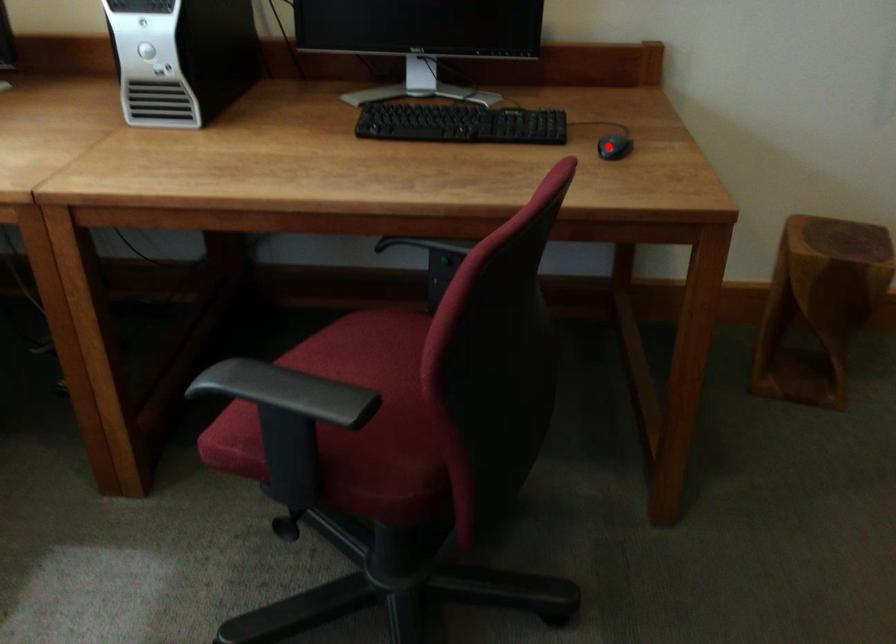
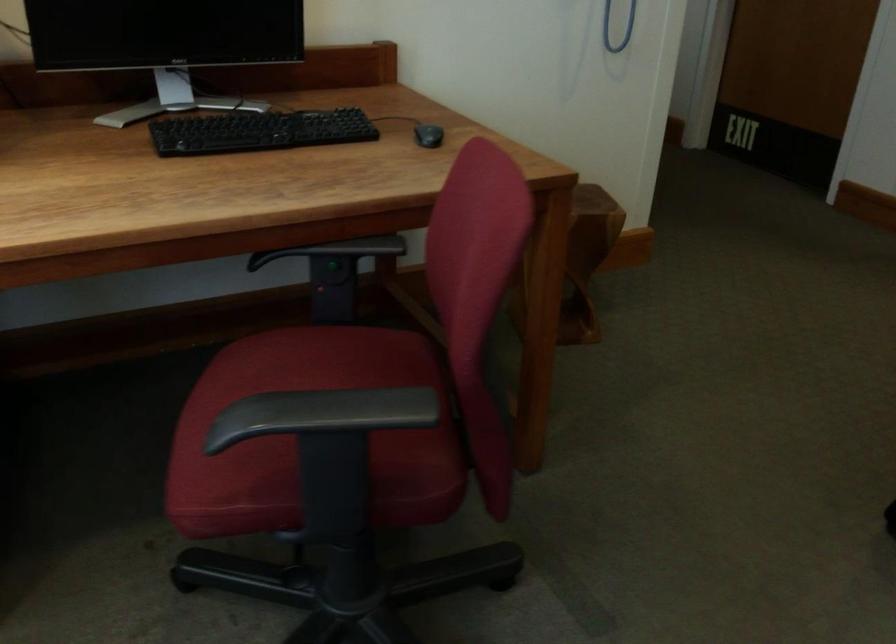
In the second image, find the point that corresponds to the highlighted location in the first image.

(427, 135)